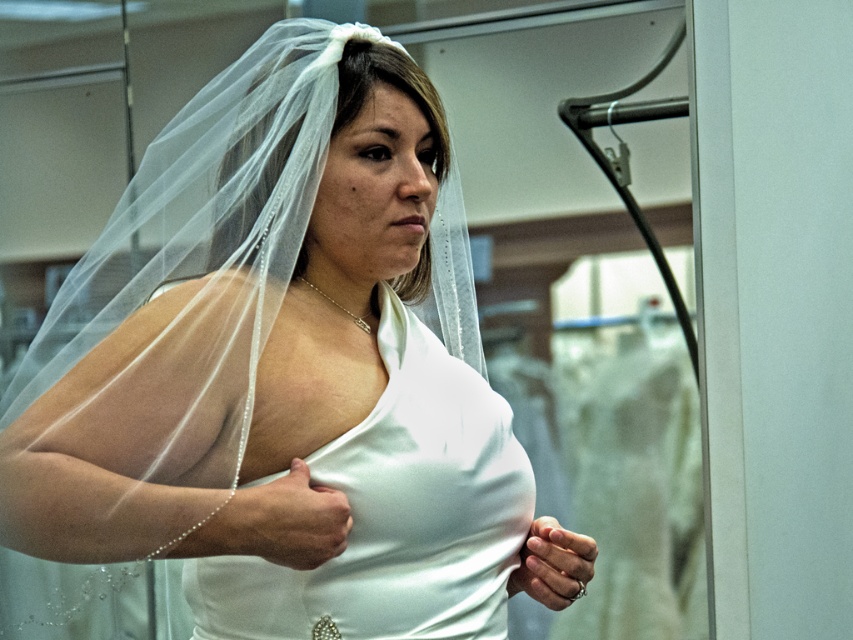
You are a photographer standing in front of the white satin dress at center and the white satin gown at center. Which one is nearer to you?

The white satin dress at center is closer to the viewer than the white satin gown at center.

From the picture: You are a wedding planner helping a bride choose her dress. You notice two white satin dresses at center in the fitting room. The bride wants to try the one underneath first. Which one should you suggest she try first, the white satin dress at center or the white satin gown at center?

The white satin gown at center is the one underneath because the white satin dress at center is positioned over it.

You are standing in a bridal shop and want to reach a specific point marked as point (276, 580). If your arm can extend 3 feet, can you reach that point without moving?

The distance between you and point (276, 580) is 3.88 feet, which is beyond your arm reach of 3 feet. Therefore, you cannot reach it without moving.